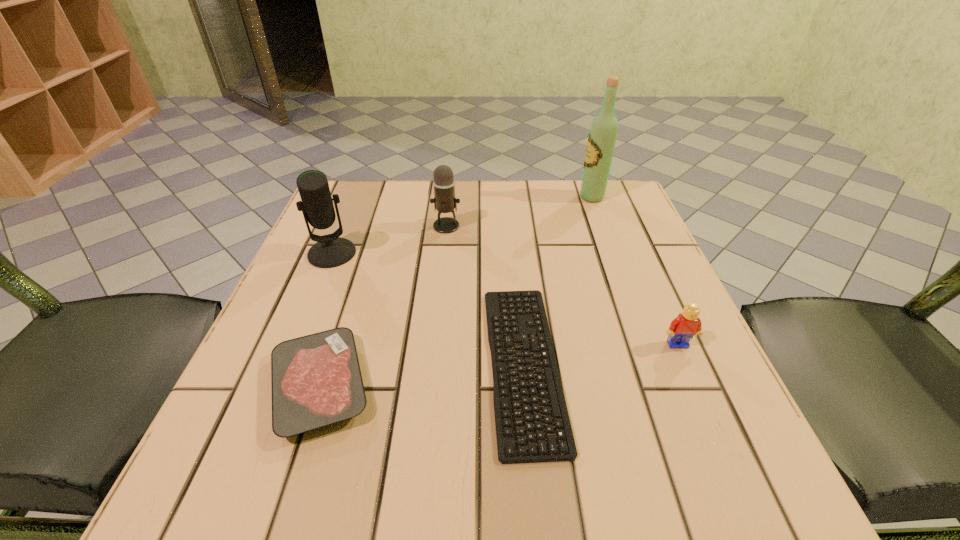
You are a GUI agent. You are given a task and a screenshot of the screen. Output one action in this format:
    pyautogui.click(x=<x>, y=<y>)
    Task: Click on the wine bottle
    The height and width of the screenshot is (540, 960).
    Given the screenshot: What is the action you would take?
    pyautogui.click(x=602, y=137)

Where is `the tallest object`? This screenshot has width=960, height=540. the tallest object is located at coordinates (602, 137).

Identify the location of the taller microphone. The height and width of the screenshot is (540, 960). (330, 251).

This screenshot has width=960, height=540. Identify the location of the left microphone. (330, 251).

Image resolution: width=960 pixels, height=540 pixels. I want to click on the fourth object from right to left, so click(444, 200).

Where is `the shorter microphone`? The height and width of the screenshot is (540, 960). the shorter microphone is located at coordinates (444, 200).

The image size is (960, 540). I want to click on Lego, so (x=687, y=324).

Locate an element on the screen. The image size is (960, 540). steak is located at coordinates 316,380.

Identify the location of computer keyboard. (506, 445).

The width and height of the screenshot is (960, 540). In order to click on the shortest object in this screenshot , I will do `click(506, 445)`.